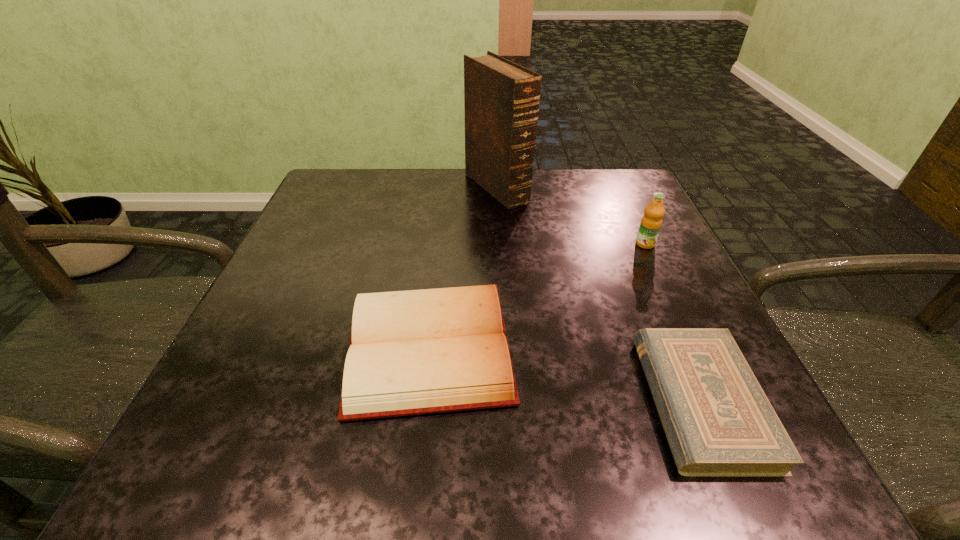
Where is `the farthest Bible`? Image resolution: width=960 pixels, height=540 pixels. the farthest Bible is located at coordinates (501, 98).

I want to click on the tallest Bible, so click(501, 98).

Where is `the third shortest object`? This screenshot has width=960, height=540. the third shortest object is located at coordinates point(651,222).

Where is `the second farthest object`? Image resolution: width=960 pixels, height=540 pixels. the second farthest object is located at coordinates (651, 222).

Find the location of a particular element. The height and width of the screenshot is (540, 960). the shortest object is located at coordinates (718, 421).

Image resolution: width=960 pixels, height=540 pixels. What are the coordinates of `the rightmost Bible` in the screenshot? It's located at (718, 421).

The height and width of the screenshot is (540, 960). What are the coordinates of `blank space located 0.120m on the left of the tallest Bible` in the screenshot? It's located at (416, 187).

Image resolution: width=960 pixels, height=540 pixels. I want to click on vacant area situated on the label of the third nearest object, so click(719, 401).

Where is `free space located 0.380m on the spine side of the shortest object`? free space located 0.380m on the spine side of the shortest object is located at coordinates (380, 401).

At what (x,y) coordinates should I click in order to perform the action: click on vacant region located on the spine side of the shortest object. Please return your answer as a coordinate pair (x, y). The height and width of the screenshot is (540, 960). Looking at the image, I should click on (607, 401).